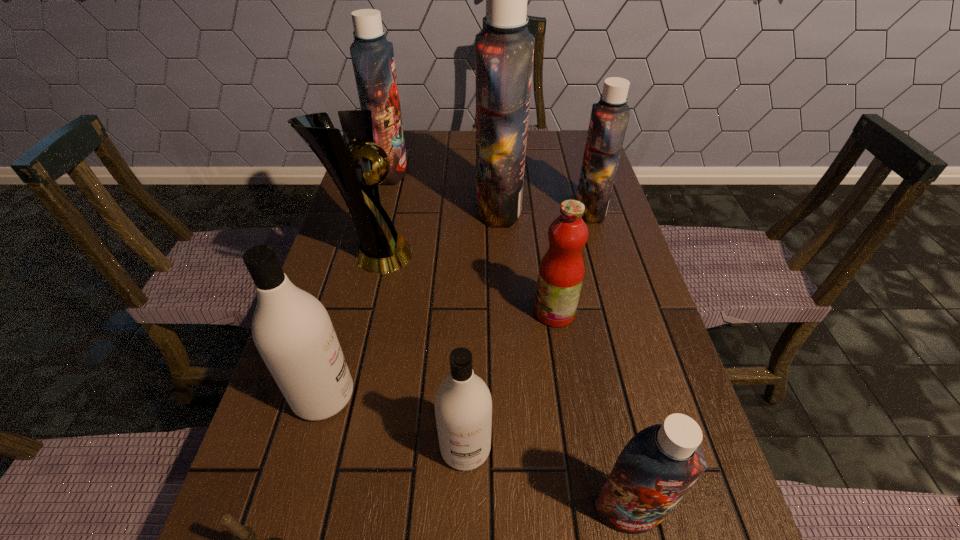
At what (x,y) coordinates should I click in order to perform the action: click on shampoo that stands as the third closest to the tallest object. Please return your answer as a coordinate pair (x, y). The width and height of the screenshot is (960, 540). Looking at the image, I should click on (292, 330).

This screenshot has width=960, height=540. Find the location of `the second closest shampoo to the biggest blue shampoo`. the second closest shampoo to the biggest blue shampoo is located at coordinates (372, 55).

Choose which blue shampoo is the nearest neighbor to the fifth shortest shampoo. Please provide its 2D coordinates. Your answer should be formatted as a tuple, i.e. [(x, y)], where the tuple contains the x and y coordinates of a point satisfying the conditions above.

[(504, 50)]

Identify the location of blue shampoo object that ranks as the third closest to the right white shampoo. (609, 118).